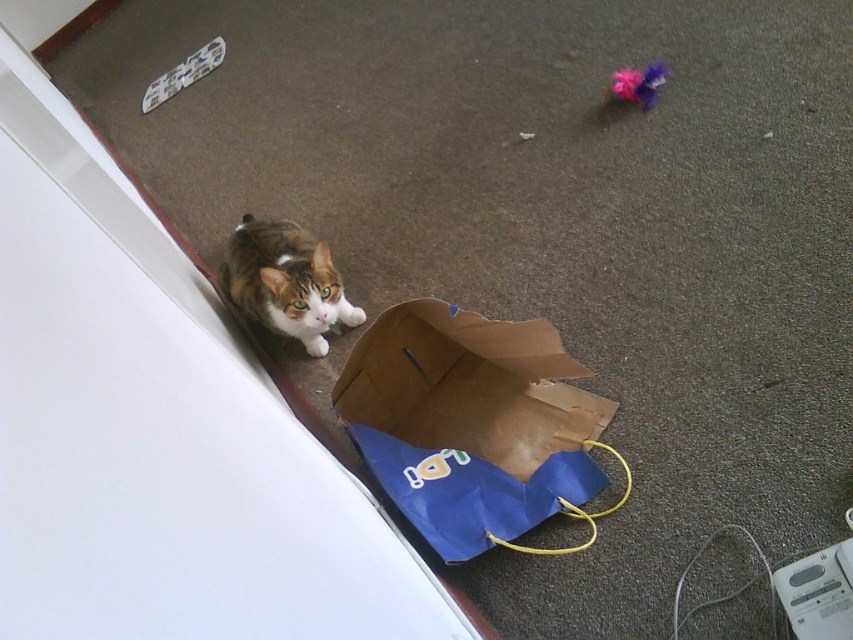
Does point (471, 547) come farther from viewer compared to point (302, 300)?

No, (471, 547) is closer to viewer.

Who is more forward, [381,476] or [254,282]?

Point [381,476] is in front.

Between point (505, 410) and point (242, 305), which one is positioned in front?

Point (505, 410) is in front.

At what (x,y) coordinates should I click in order to perform the action: click on brown paper bag at center. Please return your answer as a coordinate pair (x, y). Looking at the image, I should click on (473, 424).

This screenshot has height=640, width=853. What do you see at coordinates (286, 282) in the screenshot? I see `tabby fur cat at center` at bounding box center [286, 282].

Who is positioned more to the right, tabby fur cat at center or fuzzy fabric toy at upper right?

From the viewer's perspective, fuzzy fabric toy at upper right appears more on the right side.

Find the location of `tabby fur cat at center`. tabby fur cat at center is located at coordinates (286, 282).

Between brown paper bag at center and fuzzy fabric toy at upper right, which one appears on the left side from the viewer's perspective?

Positioned to the left is brown paper bag at center.

Between point (505, 416) and point (635, 100), which one is positioned behind?

Positioned behind is point (635, 100).

Is point (421, 337) positioned before point (637, 74)?

Yes, point (421, 337) is in front of point (637, 74).

Identify the location of brown paper bag at center. (473, 424).